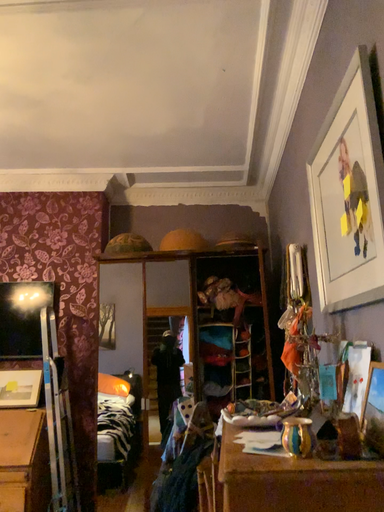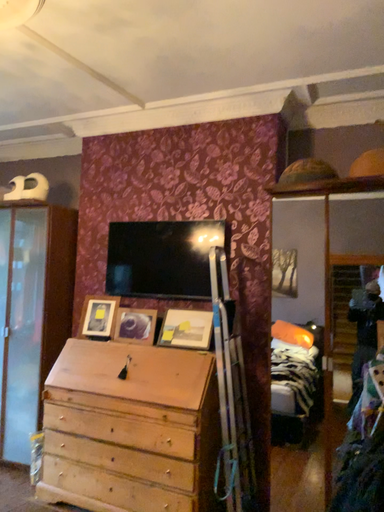
Question: Which way did the camera rotate in the video?

Choices:
 (A) rotated right
 (B) rotated left

Answer: (B)